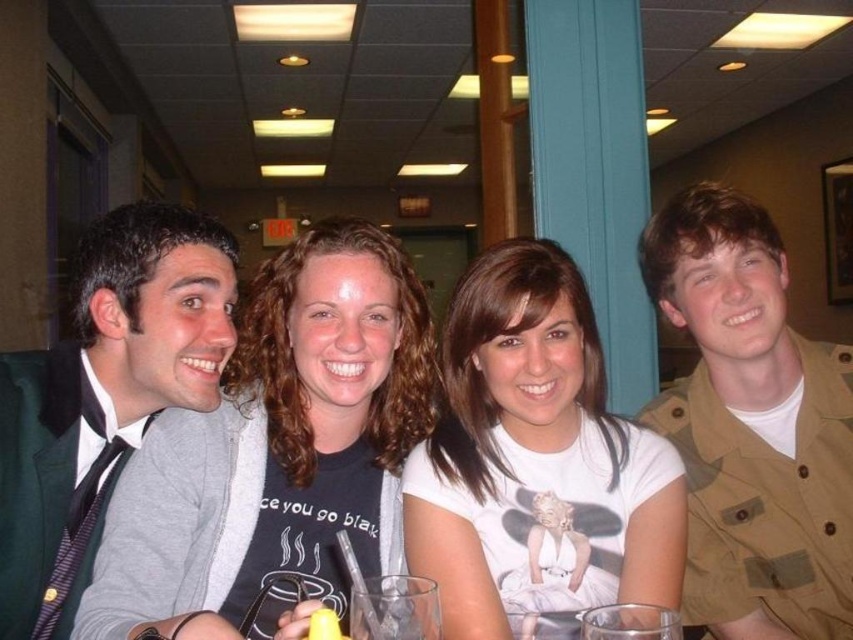
You are at a casual dining setting with four people. You notice a point at coordinates (277, 442). What object is located there?

The matte black t shirt at center is located at point (277, 442).